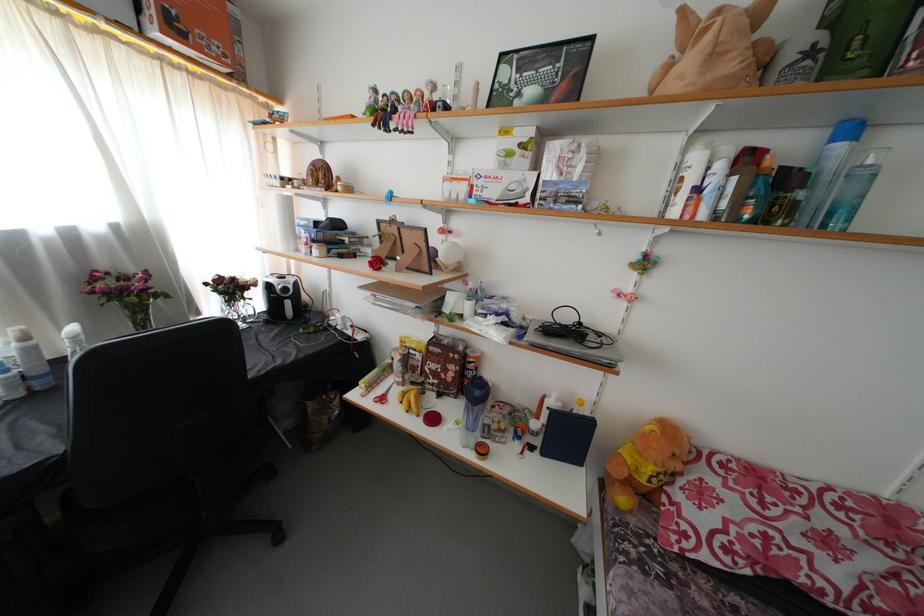
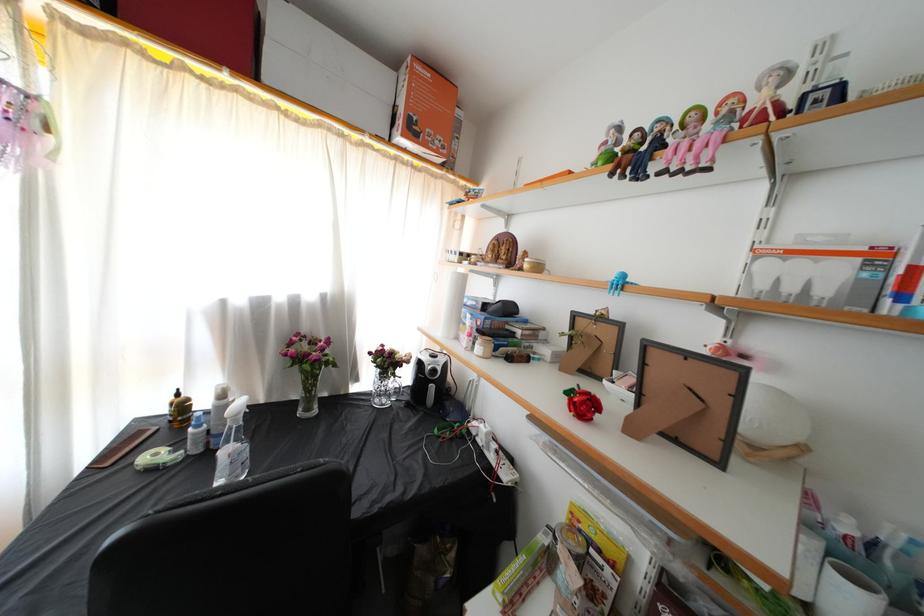
Where in the second image is the point corresponding to (407,236) from the first image?

(659, 358)